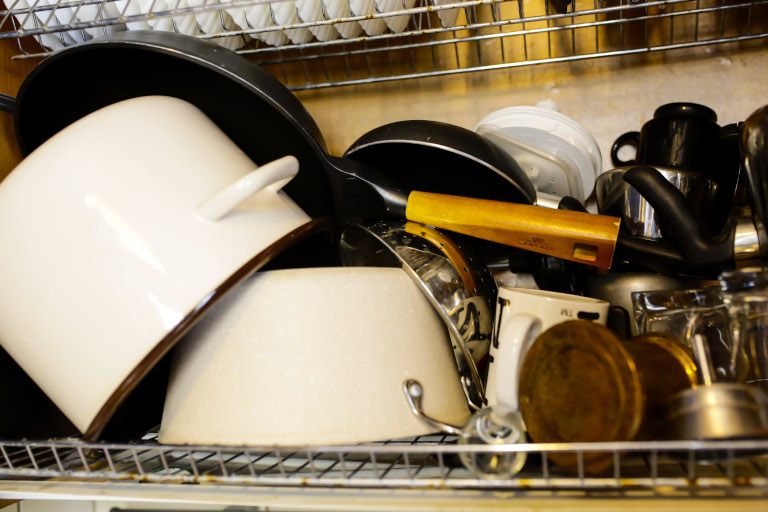
The height and width of the screenshot is (512, 768). In order to click on shelf in this screenshot , I will do 98,462, 260,23.